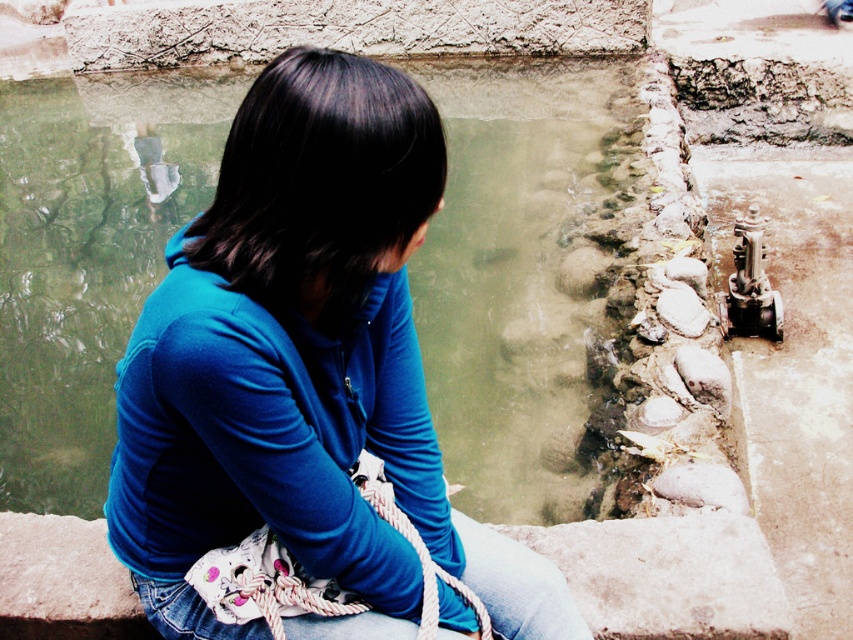
You are a photographer trying to capture the blue fabric girl at center and the denim at left in a single shot. Since you want both subjects to be clearly visible, which one should you focus on first to ensure proper exposure, considering their sizes?

The blue fabric girl at center is bigger than denim at left, so you should focus on the blue fabric girl at center first to ensure proper exposure, as larger subjects often require more attention to detail and lighting.

You are a photographer trying to capture the perfect shot of the blue fabric girl at center. Based on the coordinates provided, where should you position your camera to ensure the subject is centered in the frame?

The blue fabric girl at center is located at coordinates point (303,369), so positioning the camera directly facing those coordinates will center her in the frame.